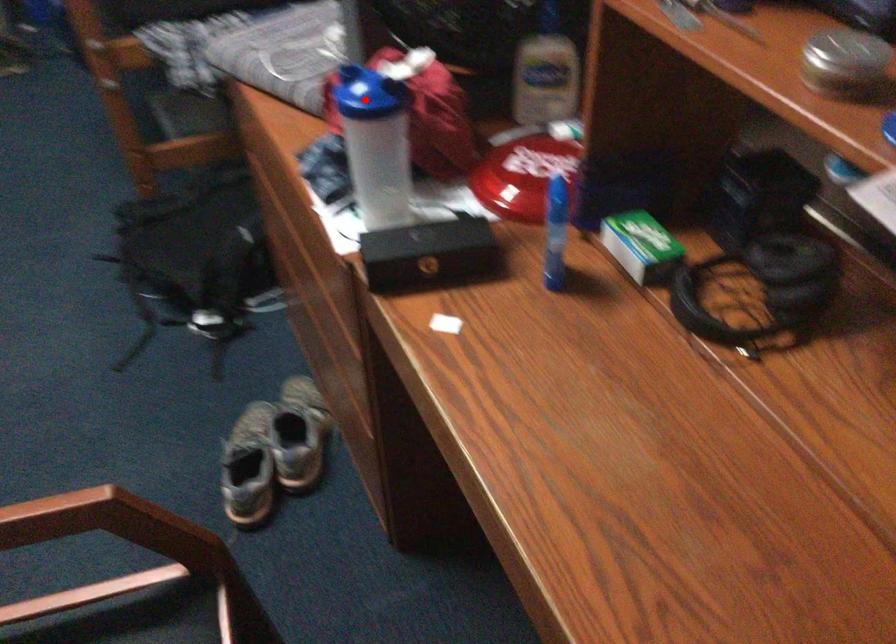
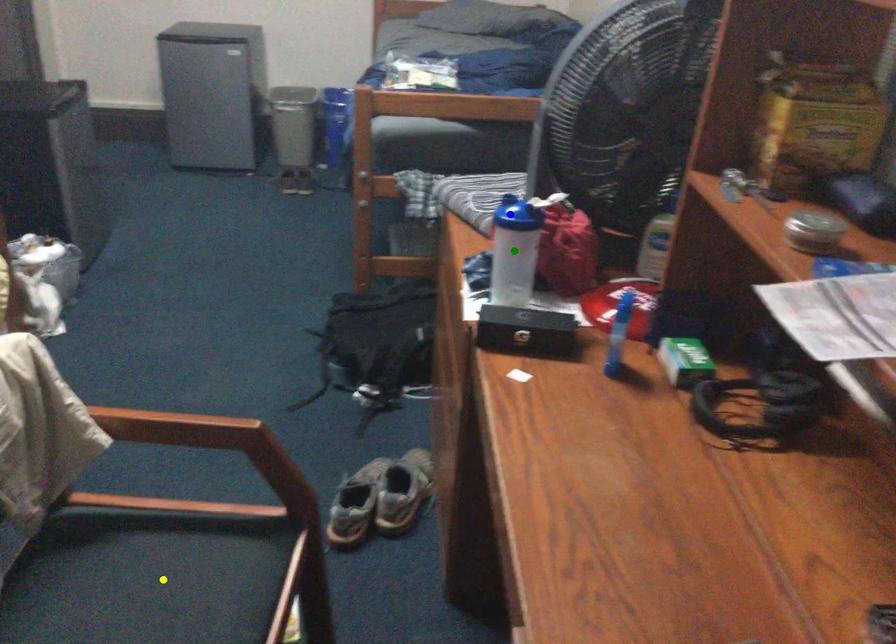
Question: I am providing you with two images of the same scene from different viewpoints. A red point is marked on the first image. You are given multiple points on the second image. Which spot in image 2 lines up with the point in image 1?

Choices:
 (A) blue point
 (B) green point
 (C) yellow point

Answer: (A)